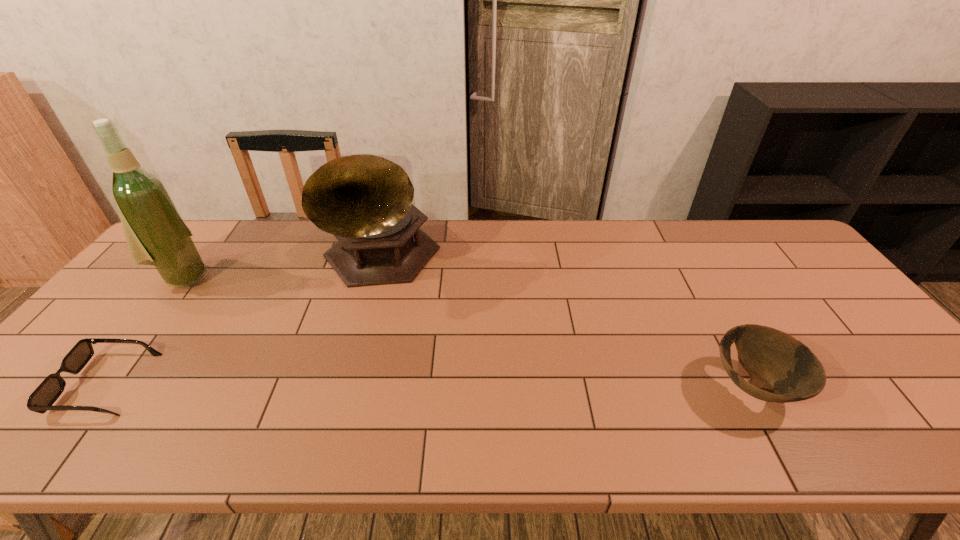
I want to click on free space located 0.280m on the horn direction of the third object from left to right, so click(466, 366).

Identify the location of vacant space located on the horn direction of the third object from left to right. This screenshot has height=540, width=960. (472, 374).

Find the location of a particular element. This screenshot has width=960, height=540. free location located 0.330m on the horn direction of the third object from left to right is located at coordinates (477, 379).

You are a GUI agent. You are given a task and a screenshot of the screen. Output one action in this format:
    pyautogui.click(x=<x>, y=<y>)
    Task: Click on the wine bottle that is at the far edge
    
    Given the screenshot: What is the action you would take?
    pyautogui.click(x=156, y=235)

Where is `phonograph record located at the far edge`? The image size is (960, 540). phonograph record located at the far edge is located at coordinates (365, 201).

Find the location of a particular element. This screenshot has width=960, height=540. sunglasses that is at the near edge is located at coordinates (44, 396).

The width and height of the screenshot is (960, 540). What are the coordinates of `bowl located at the near edge` in the screenshot? It's located at (776, 362).

Locate an element on the screen. sunglasses present at the left edge is located at coordinates (44, 396).

This screenshot has height=540, width=960. What are the coordinates of `wine bottle situated at the left edge` in the screenshot? It's located at (156, 235).

Locate an element on the screen. object that is at the far left corner is located at coordinates pos(156,235).